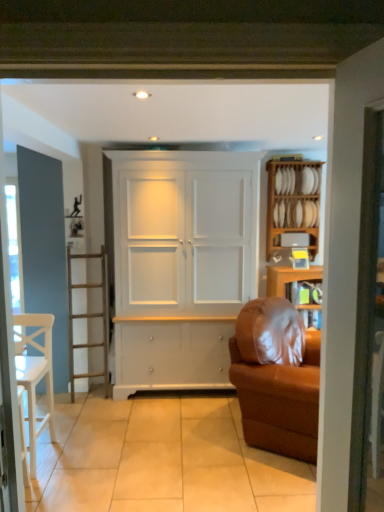
Question: Is brown fabric couch at right looking in the opposite direction of white wooden shelf at upper right, the 2th shelf from the top?

Choices:
 (A) no
 (B) yes

Answer: (A)

Question: Does brown fabric couch at right have a greater width compared to white wooden shelf at upper right, the 2th shelf from the top?

Choices:
 (A) no
 (B) yes

Answer: (B)

Question: Is brown fabric couch at right oriented towards white wooden shelf at upper right, the first shelf when ordered from bottom to top?

Choices:
 (A) no
 (B) yes

Answer: (A)

Question: Is the depth of brown fabric couch at right less than that of white wooden shelf at upper right, the first shelf when ordered from bottom to top?

Choices:
 (A) no
 (B) yes

Answer: (B)

Question: From the image's perspective, is brown fabric couch at right located above white wooden shelf at upper right, the first shelf when ordered from bottom to top?

Choices:
 (A) no
 (B) yes

Answer: (A)

Question: From a real-world perspective, is brown fabric couch at right located higher than white wooden shelf at upper right, the first shelf when ordered from bottom to top?

Choices:
 (A) yes
 (B) no

Answer: (B)

Question: Considering the relative sizes of wooden plate rack at right, which is the second shelf from bottom to top, and white wood chair at left in the image provided, is wooden plate rack at right, which is the second shelf from bottom to top, wider than white wood chair at left?

Choices:
 (A) yes
 (B) no

Answer: (B)

Question: Is wooden plate rack at right, which is the 1th shelf from top to bottom, not near white wood chair at left?

Choices:
 (A) no
 (B) yes

Answer: (B)

Question: Could white wood chair at left be considered to be inside wooden plate rack at right, which is the second shelf from bottom to top?

Choices:
 (A) yes
 (B) no

Answer: (B)

Question: From a real-world perspective, is wooden plate rack at right, which is the second shelf from bottom to top, beneath white wood chair at left?

Choices:
 (A) no
 (B) yes

Answer: (A)

Question: Is wooden plate rack at right, which is the 1th shelf from top to bottom, smaller than white wood chair at left?

Choices:
 (A) no
 (B) yes

Answer: (B)

Question: Is wooden plate rack at right, which is the second shelf from bottom to top, to the left of white wood chair at left from the viewer's perspective?

Choices:
 (A) yes
 (B) no

Answer: (B)

Question: Is white matte cabinet at center to the right of wooden plate rack at right, which is the second shelf from bottom to top, from the viewer's perspective?

Choices:
 (A) yes
 (B) no

Answer: (B)